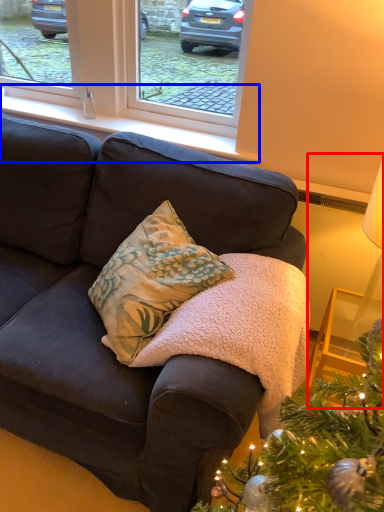
Question: Which of the following is the farthest to the observer, table lamp (highlighted by a red box) or window sill (highlighted by a blue box)?

Choices:
 (A) table lamp
 (B) window sill

Answer: (B)